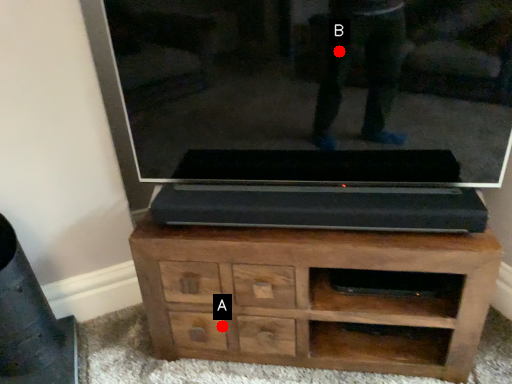
Question: Two points are circled on the image, labeled by A and B beside each circle. Among these points, which one is nearest to the camera?

Choices:
 (A) A is closer
 (B) B is closer

Answer: (B)